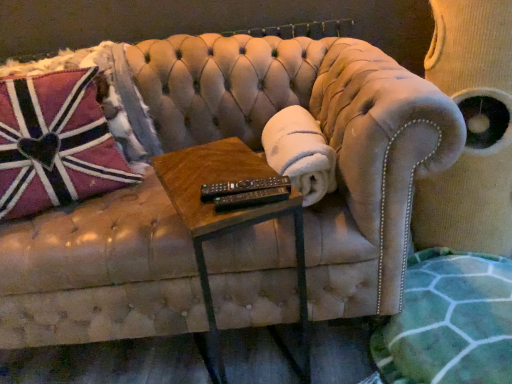
At what (x,y) coordinates should I click in order to perform the action: click on vacant area on top of woodenmaterial/texturetable at center (from a real-world perspective). Please return your answer as a coordinate pair (x, y). The width and height of the screenshot is (512, 384). Looking at the image, I should click on (216, 170).